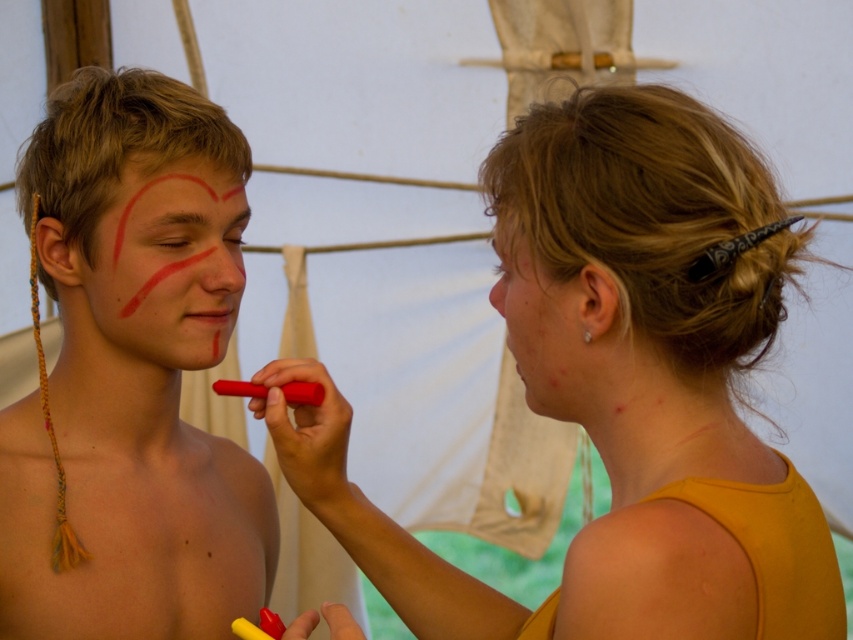
Question: Among these objects, which one is farthest from the camera?

Choices:
 (A) smooth yellow tank top at upper right
 (B) matte red paint at center
 (C) smooth red paint at center
 (D) matte red eyebrow at upper left

Answer: (D)

Question: Among these points, which one is nearest to the camera?

Choices:
 (A) (520, 374)
 (B) (643, 230)

Answer: (B)

Question: Is matte red eyebrow at upper left in front of smooth red paint at center?

Choices:
 (A) yes
 (B) no

Answer: (B)

Question: Does matte red paint at left appear on the right side of matte red eyebrow at upper left?

Choices:
 (A) yes
 (B) no

Answer: (B)

Question: Among these points, which one is nearest to the camera?

Choices:
 (A) (177, 218)
 (B) (566, 406)
 (C) (582, 557)

Answer: (C)

Question: Is matte red paint at left positioned behind matte red paint at center?

Choices:
 (A) yes
 (B) no

Answer: (B)